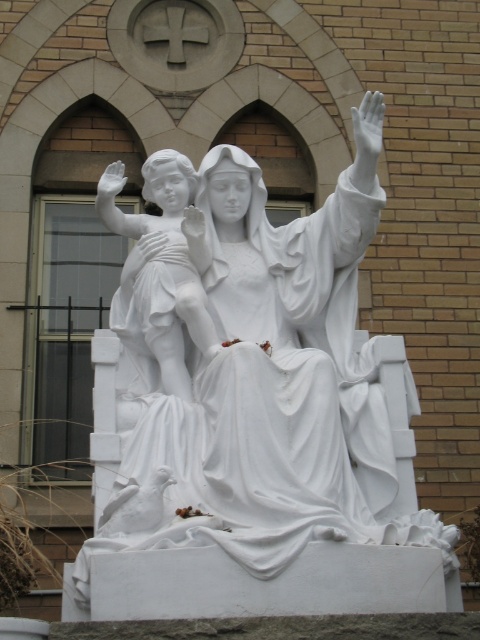
Question: In this image, where is white marble statue at center located relative to white marble hand at upper center?

Choices:
 (A) right
 (B) left

Answer: (A)

Question: Which point is closer to the camera taking this photo?

Choices:
 (A) (105, 172)
 (B) (355, 404)
 (C) (183, 378)

Answer: (B)

Question: Can you confirm if white marble cherub at center is wider than white marble hand at upper center?

Choices:
 (A) yes
 (B) no

Answer: (A)

Question: Based on their relative distances, which object is nearer to the white marble statue at center?

Choices:
 (A) white marble cherub at center
 (B) white marble hand at upper center

Answer: (A)

Question: From the image, what is the correct spatial relationship of white marble statue at center in relation to white marble hand at upper center?

Choices:
 (A) above
 (B) below

Answer: (B)

Question: Which of the following is the farthest from the observer?

Choices:
 (A) white marble statue at center
 (B) white marble cherub at center

Answer: (B)